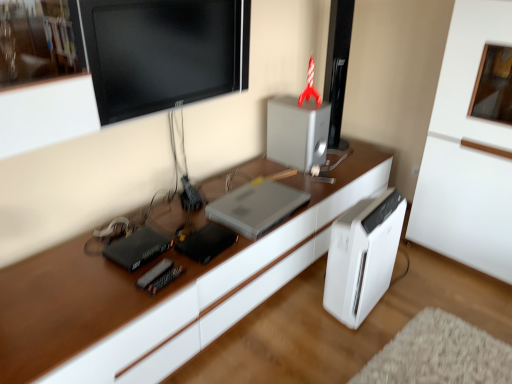
The width and height of the screenshot is (512, 384). Find the location of `free space on the front side of white plastic air purifier at lower right`. free space on the front side of white plastic air purifier at lower right is located at coordinates (371, 344).